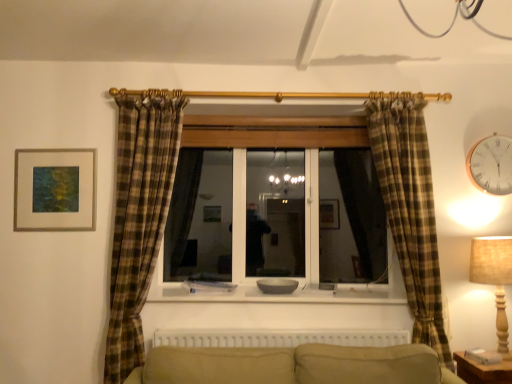
Locate an element on the screen. This screenshot has width=512, height=384. empty space that is ontop of white plastic radiator at lower center (from a real-world perspective) is located at coordinates (297, 319).